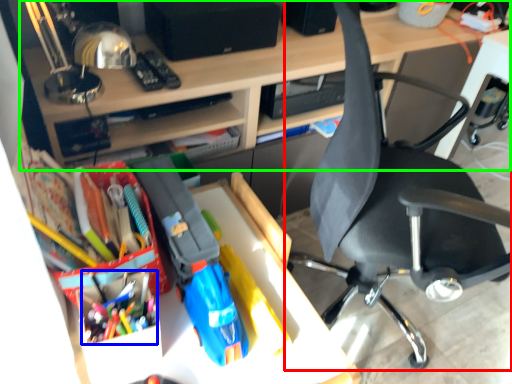
Question: Considering the real-world distances, which object is closest to chair (highlighted by a red box)? stationery (highlighted by a blue box) or desk (highlighted by a green box).

Choices:
 (A) stationery
 (B) desk

Answer: (B)